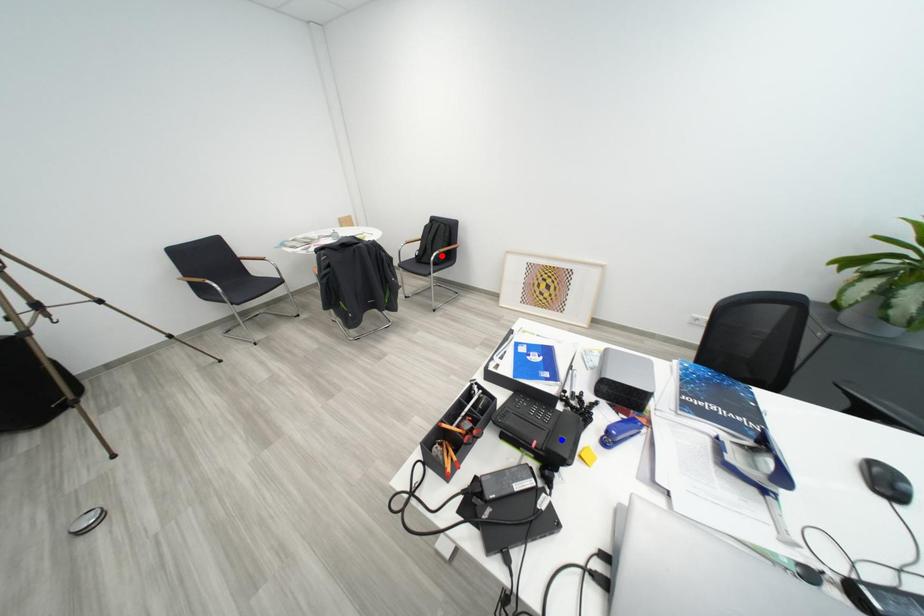
Question: Two points are marked on the image. Which point is closer to the camera?

Choices:
 (A) Blue point is closer.
 (B) Red point is closer.

Answer: (A)